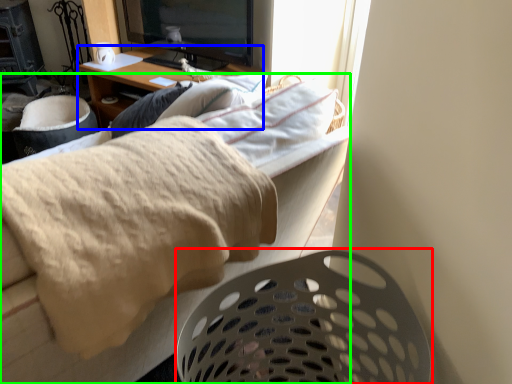
Question: Considering the real-world distances, which object is farthest from laundry basket (highlighted by a red box)? desk (highlighted by a blue box) or furniture (highlighted by a green box)?

Choices:
 (A) desk
 (B) furniture

Answer: (A)